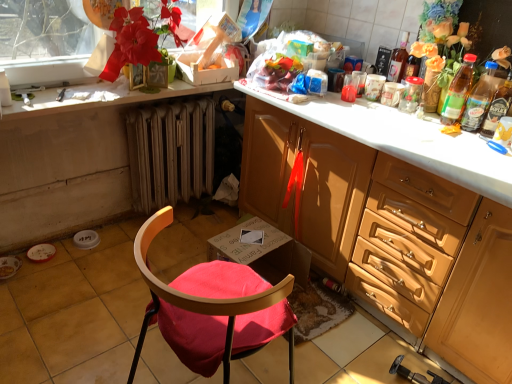
Image resolution: width=512 pixels, height=384 pixels. What are the coordinates of `free location in front of translucent plastic bottle at right, which is the 3th bottle from left to right` in the screenshot? It's located at coord(471,141).